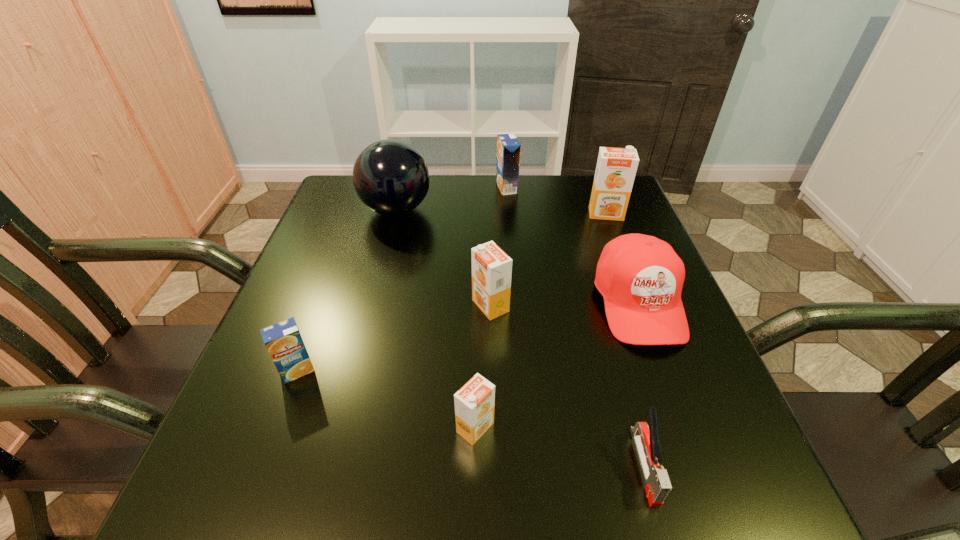
You are a GUI agent. You are given a task and a screenshot of the screen. Output one action in this format:
    pyautogui.click(x=<x>, y=<y>)
    Task: Click on the bowling ball present at the far edge
    This screenshot has width=960, height=540.
    Given the screenshot: What is the action you would take?
    (390, 177)

Where is `object positioned at the near edge`? object positioned at the near edge is located at coordinates (647, 443).

This screenshot has width=960, height=540. Find the location of `bowling ball located at the left edge`. bowling ball located at the left edge is located at coordinates (390, 177).

I want to click on orange_juice located in the left edge section of the desktop, so click(x=283, y=341).

Where is `orange juice situated at the right edge`? orange juice situated at the right edge is located at coordinates (616, 168).

Locate an element on the screen. baseball cap that is at the right edge is located at coordinates (640, 277).

The width and height of the screenshot is (960, 540). I want to click on stapler present at the right edge, so click(x=647, y=443).

At what (x,y) coordinates should I click in order to perform the action: click on object at the far left corner. Please return your answer as a coordinate pair (x, y). Looking at the image, I should click on (390, 177).

Locate an element on the screen. Image resolution: width=960 pixels, height=540 pixels. object that is at the far right corner is located at coordinates (616, 168).

Find the location of `object present at the near right corner`. object present at the near right corner is located at coordinates (647, 443).